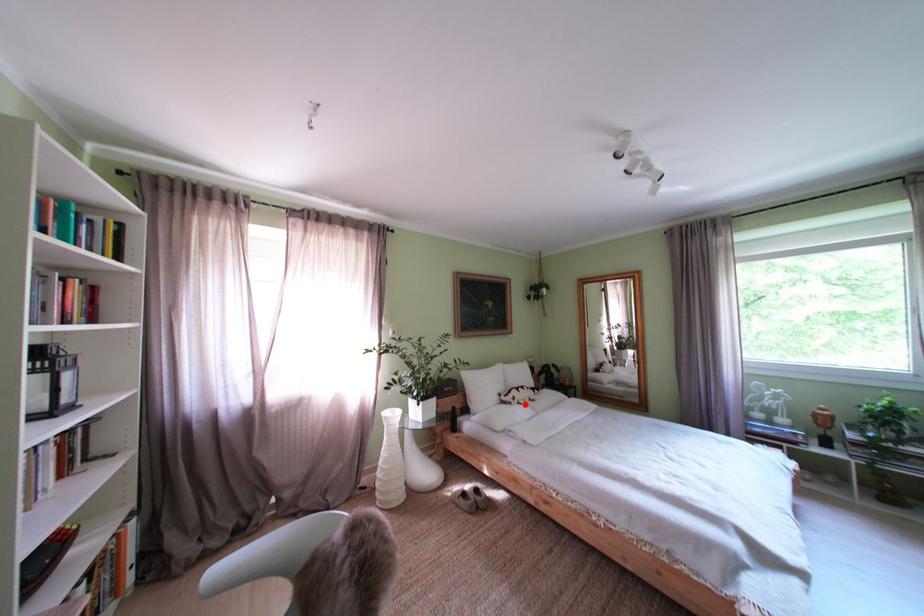
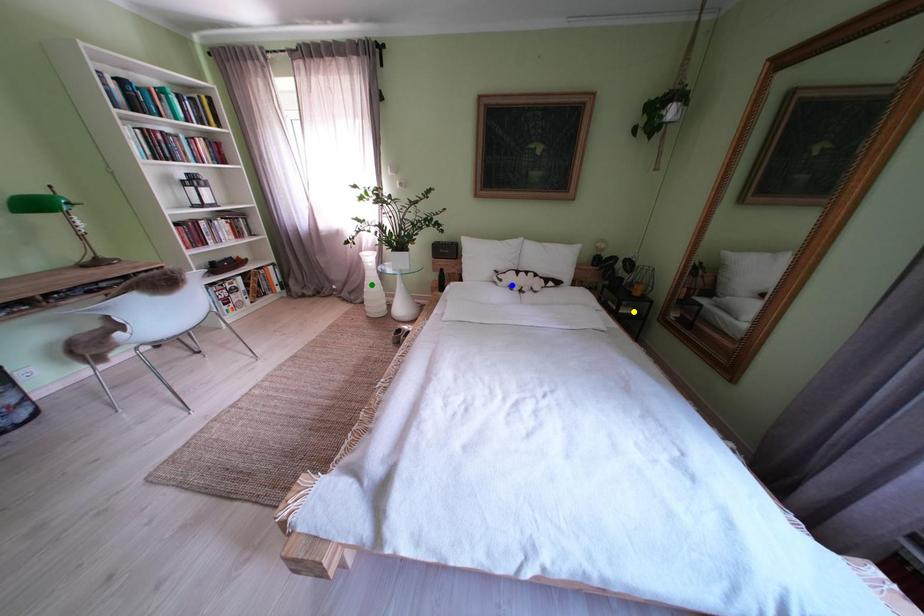
Question: I am providing you with two images of the same scene from different viewpoints. A red point is marked on the first image. You are given multiple points on the second image. Can you choose the point in image 2 that corresponds to the point in image 1?

Choices:
 (A) blue point
 (B) yellow point
 (C) green point

Answer: (A)